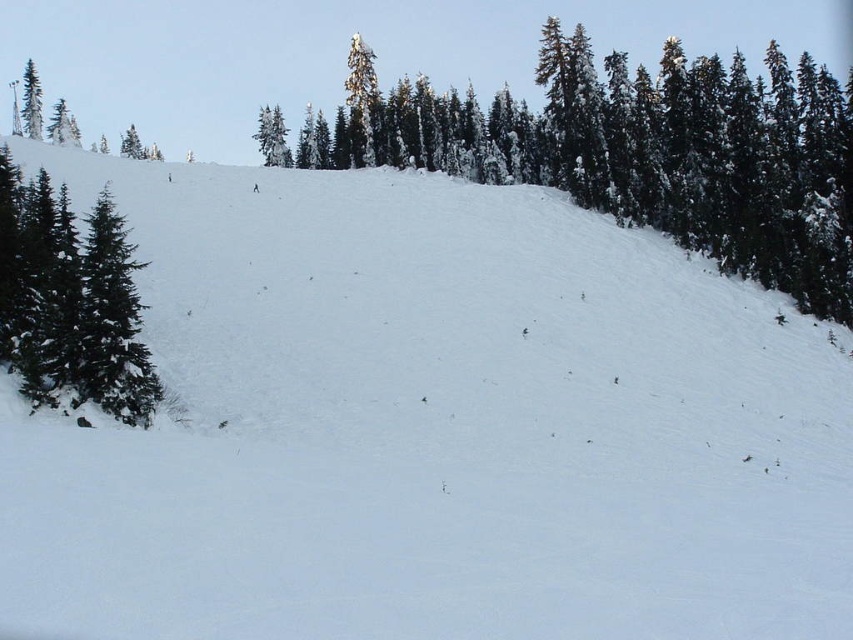
Question: Which object is the farthest from the green matte tree at left?

Choices:
 (A) green matte tree at upper left
 (B) green textured trees at upper center

Answer: (A)

Question: Considering the real-world distances, which object is closest to the green matte tree at left?

Choices:
 (A) green matte tree at upper left
 (B) green textured trees at upper center

Answer: (B)

Question: Which point appears closest to the camera in this image?

Choices:
 (A) (36, 128)
 (B) (663, 192)
 (C) (97, 312)

Answer: (C)

Question: Is green textured trees at upper center bigger than green matte tree at left?

Choices:
 (A) yes
 (B) no

Answer: (A)

Question: Is green matte tree at left smaller than green matte tree at upper left?

Choices:
 (A) no
 (B) yes

Answer: (B)

Question: Can you confirm if green textured trees at upper center is wider than green matte tree at upper left?

Choices:
 (A) yes
 (B) no

Answer: (A)